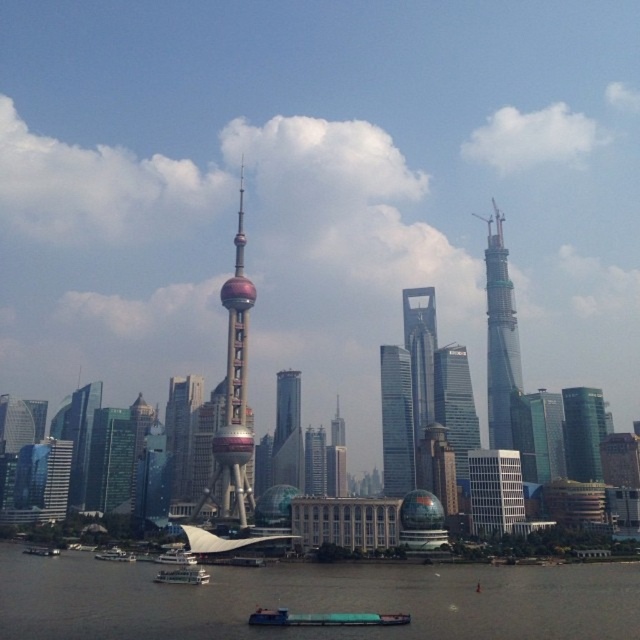
You are standing at the point marked as point [314,461]. Which structure are you currently on?

You are on the matte glass skyscraper at center because the point [314,461] is located on it.

You are a tourist standing on the observation deck of the Oriental Pearl Tower. You notice a glassy metallic skyscraper at center and a white plastic boat at lower left in the distance. Which object appears taller from your vantage point?

The glassy metallic skyscraper at center appears taller than the white plastic boat at lower left from your vantage point on the observation deck of the Oriental Pearl Tower.

You are a tourist standing on the ferry dock and want to take a photo of the skyline. You see the matte glass skyscraper at center and the white plastic boat at lower left. Which object is closer to the right side of your view?

The matte glass skyscraper at center is positioned on the right side of the white plastic boat at lower left, so it is closer to the right side of your view.